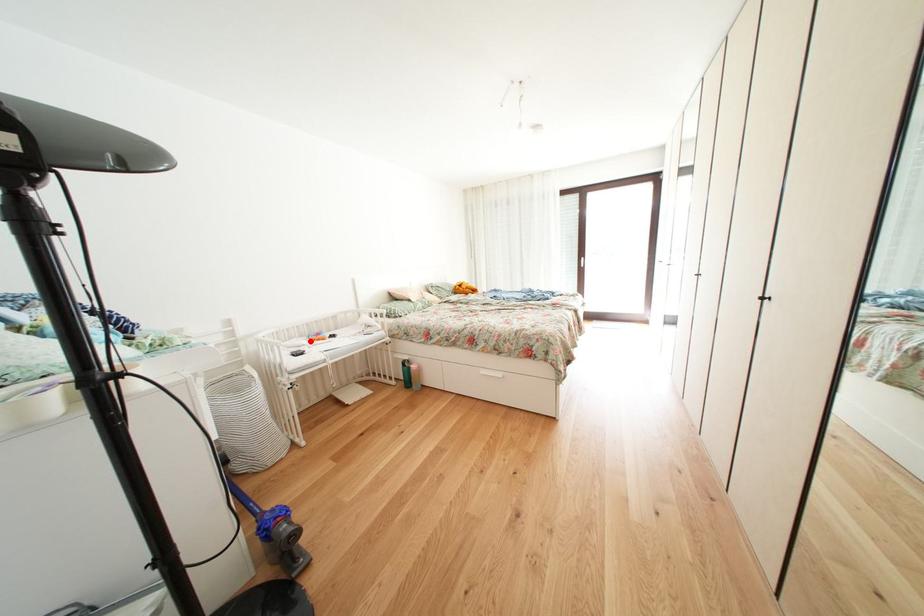
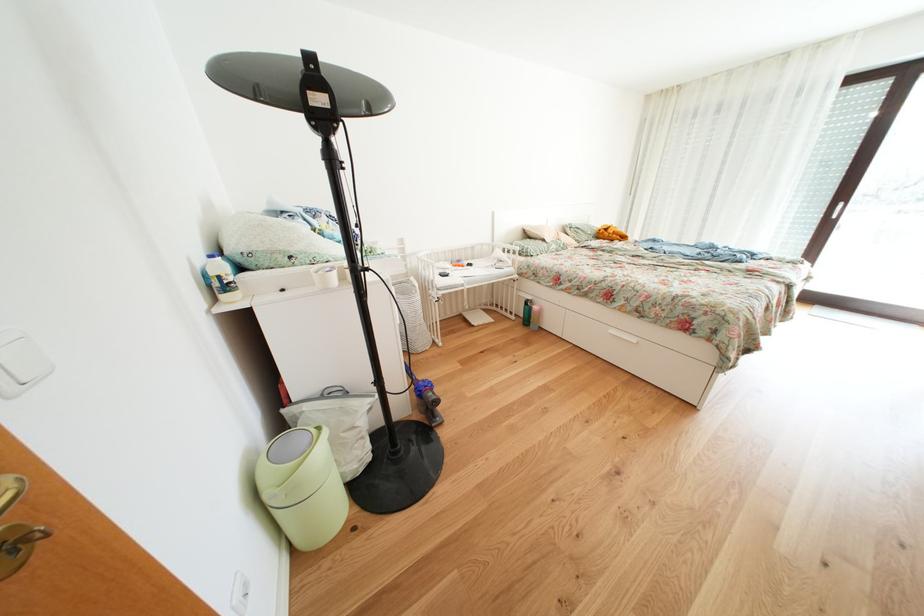
Locate, in the second image, the point that corresponds to the highlighted location in the first image.

(456, 265)